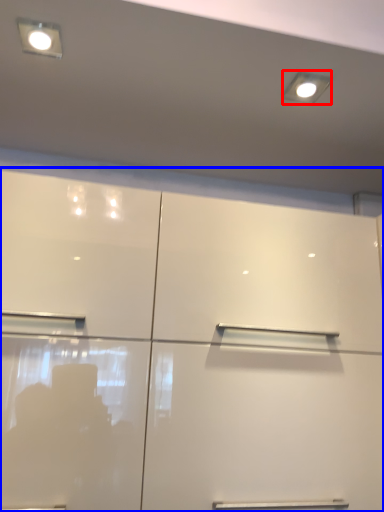
Question: Which object is closer to the camera taking this photo, lighting (highlighted by a red box) or cupboard (highlighted by a blue box)?

Choices:
 (A) lighting
 (B) cupboard

Answer: (B)